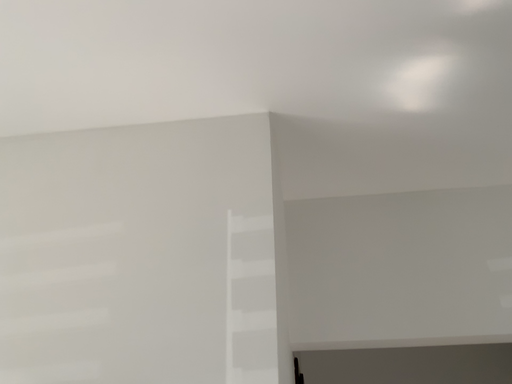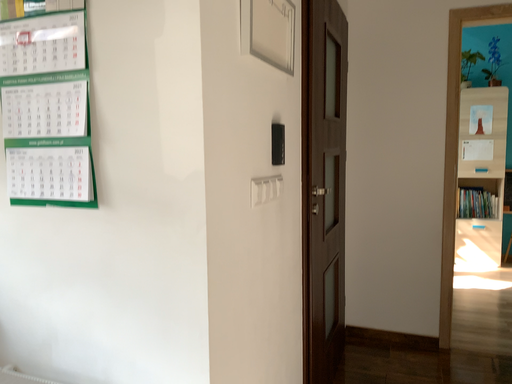
Question: How did the camera likely rotate when shooting the video?

Choices:
 (A) rotated downward
 (B) rotated upward

Answer: (A)